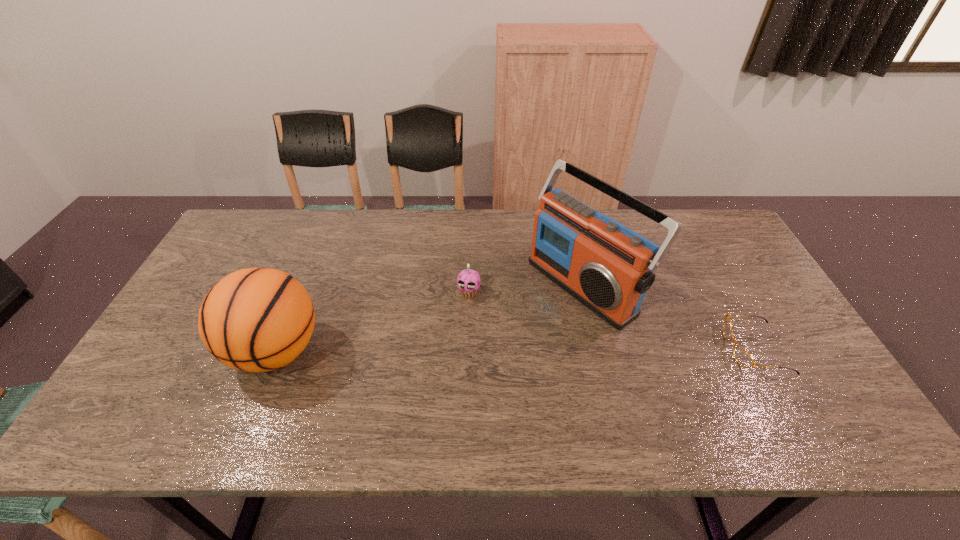
You are a GUI agent. You are given a task and a screenshot of the screen. Output one action in this format:
    pyautogui.click(x=<x>, y=<y>)
    Task: Click on the vacant space on the desktop that is between the basketball and the spectacles and is positioned on the front-facing side of the tallest object
    This screenshot has height=540, width=960.
    Given the screenshot: What is the action you would take?
    pyautogui.click(x=486, y=350)

Where is `vacant space on the desktop that is between the second tallest object and the spectacles and is positioned on the face of the second object from left to right`? This screenshot has height=540, width=960. vacant space on the desktop that is between the second tallest object and the spectacles and is positioned on the face of the second object from left to right is located at coordinates (449, 350).